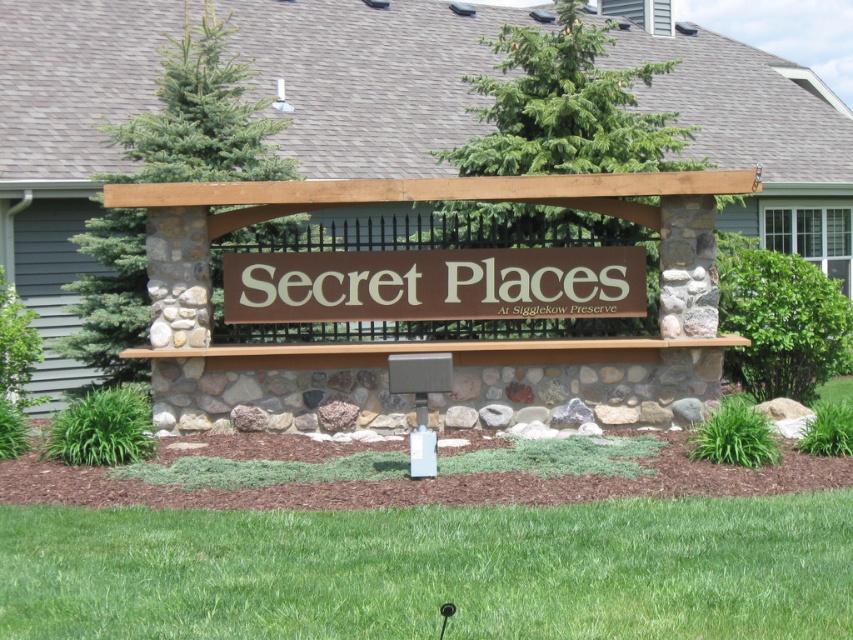
Consider the image. You are standing in front of the signboard and want to walk towards the brown wood pergola at center. Which direction should you move relative to the brown matte sign at center?

The brown wood pergola at center is closer to you than the brown matte sign at center, so you should move forward towards the brown wood pergola at center, which is in front of the brown matte sign at center.

You are standing in front of the signboard and want to walk towards the brown wood pergola at center. What direction should you walk in?

The brown wood pergola at center is located at coordinates (369, 77), so you should walk towards the center of the scene to reach it.

You are planning to install a new bench between the brown wood pergola at center and the brown matte sign at center. The bench requires 2 meters of space. Is there enough space between them to place the bench?

The brown wood pergola at center and brown matte sign at center are 9.69 meters apart, so yes, there is enough space to place the bench between them since 9.69 meters is greater than 2 meters.